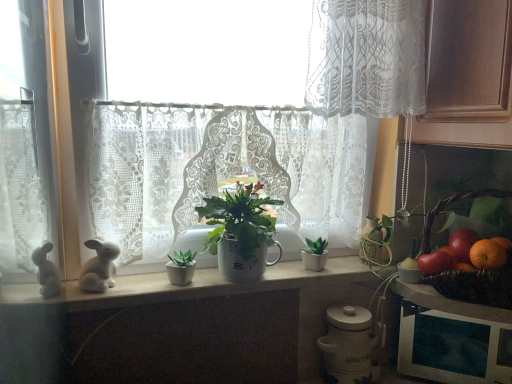
The width and height of the screenshot is (512, 384). What do you see at coordinates (476, 285) in the screenshot?
I see `brown woven basket at right` at bounding box center [476, 285].

What do you see at coordinates (240, 232) in the screenshot?
I see `white ceramic mug at center` at bounding box center [240, 232].

Image resolution: width=512 pixels, height=384 pixels. Describe the element at coordinates (435, 262) in the screenshot. I see `shiny red tomato at right, which ranks as the first fruit in left-to-right order` at that location.

Describe the element at coordinates (487, 254) in the screenshot. I see `orange matte at right` at that location.

In order to face wooden framed picture at lower right, should I rotate leftwards or rightwards?

Turn right by 25.336 degrees to look at wooden framed picture at lower right.

Measure the distance between shiny red tomato at right, acting as the 1th fruit starting from the right, and camera.

shiny red tomato at right, acting as the 1th fruit starting from the right, is 1.01 meters away from camera.

The height and width of the screenshot is (384, 512). I want to click on white lace curtain at upper center, the second curtain positioned from the left, so click(367, 58).

Identify the location of brown woven basket at right. (476, 285).

Is shiny red tomato at right, acting as the 1th fruit starting from the right, situated inside white lace curtain at center, arranged as the second curtain when viewed from the right, or outside?

shiny red tomato at right, acting as the 1th fruit starting from the right, is outside white lace curtain at center, arranged as the second curtain when viewed from the right.

Can you confirm if shiny red tomato at right, acting as the 1th fruit starting from the right, is taller than white lace curtain at center, the second curtain positioned from the top?

Incorrect, the height of shiny red tomato at right, acting as the 1th fruit starting from the right, is not larger of that of white lace curtain at center, the second curtain positioned from the top.

Could you measure the distance between shiny red tomato at right, acting as the 1th fruit starting from the right, and white lace curtain at center, arranged as the second curtain when viewed from the right?

shiny red tomato at right, acting as the 1th fruit starting from the right, and white lace curtain at center, arranged as the second curtain when viewed from the right, are 22.06 inches apart from each other.

Is shiny red tomato at right, acting as the 1th fruit starting from the right, far away from white lace curtain at center, which is the first curtain in bottom-to-top order?

No.

From the image's perspective, between orange matte at right and white ceramic mug at center, who is located below?

orange matte at right.

Is orange matte at right in front of or behind white ceramic mug at center in the image?

Visually, orange matte at right is located in front of white ceramic mug at center.

Does point (492, 239) lie in front of point (219, 222)?

Yes, it is.

Find the location of a particular element. This screenshot has width=512, height=384. orange in front of the white ceramic mug at center is located at coordinates (487, 254).

From the picture: From a real-world perspective, relative to matte white flowerpot at center, is brown woven basket at right vertically above or below?

In terms of real-world spatial position, brown woven basket at right is above matte white flowerpot at center.

Is brown woven basket at right touching matte white flowerpot at center?

No, brown woven basket at right is not next to matte white flowerpot at center.

How far apart are brown woven basket at right and matte white flowerpot at center?

brown woven basket at right is 66.53 centimeters from matte white flowerpot at center.

Can you tell me how much brown woven basket at right and matte white flowerpot at center differ in facing direction?

49.3 degrees.

From the picture: Can you confirm if white ceramic mug at center is smaller than white glossy rabbit at left?

No, white ceramic mug at center is not smaller than white glossy rabbit at left.

Is white ceramic mug at center not within white glossy rabbit at left?

That's correct, white ceramic mug at center is outside of white glossy rabbit at left.

Is white ceramic mug at center to the left of white glossy rabbit at left from the viewer's perspective?

In fact, white ceramic mug at center is to the right of white glossy rabbit at left.

From the image's perspective, does white ceramic mug at center appear lower than white glossy rabbit at left?

Incorrect, from the image's perspective, white ceramic mug at center is higher than white glossy rabbit at left.

Is orange matte at right at the left side of shiny red tomato at right, which appears as the 2th fruit when viewed from the right?

No.

Can you tell me how much orange matte at right and shiny red tomato at right, which appears as the 2th fruit when viewed from the right, differ in facing direction?

The facing directions of orange matte at right and shiny red tomato at right, which appears as the 2th fruit when viewed from the right, are 0.00263 degrees apart.

Does orange matte at right have a lesser height compared to shiny red tomato at right, which ranks as the first fruit in left-to-right order?

Indeed, orange matte at right has a lesser height compared to shiny red tomato at right, which ranks as the first fruit in left-to-right order.

The height and width of the screenshot is (384, 512). I want to click on fruit below the orange matte at right (from the image's perspective), so click(435, 262).

Does brown woven basket at right have a greater width compared to white matte counter top at center?

Yes.

Is brown woven basket at right turned away from white matte counter top at center?

brown woven basket at right does not have its back to white matte counter top at center.

Between brown woven basket at right and white matte counter top at center, which one is positioned in front?

brown woven basket at right.

From a real-world perspective, relative to white matte counter top at center, is brown woven basket at right vertically above or below?

brown woven basket at right is situated higher than white matte counter top at center in the real world.

Is brown woven basket at right positioned beyond the bounds of white lace curtain at center, arranged as the second curtain when viewed from the right?

brown woven basket at right is positioned outside white lace curtain at center, arranged as the second curtain when viewed from the right.

From the image's perspective, is brown woven basket at right above white lace curtain at center, the second curtain positioned from the top?

No, from the image's perspective, brown woven basket at right is not over white lace curtain at center, the second curtain positioned from the top.

Measure the distance from brown woven basket at right to white lace curtain at center, arranged as the second curtain when viewed from the right.

They are 49.09 centimeters apart.

Where is `the 2nd fruit behind the white lace curtain at center, which is the first curtain in bottom-to-top order, starting your count from the anchor`? Image resolution: width=512 pixels, height=384 pixels. the 2nd fruit behind the white lace curtain at center, which is the first curtain in bottom-to-top order, starting your count from the anchor is located at coordinates click(462, 244).

Locate an element on the screen. houseplant located on the left of orange matte at right is located at coordinates (240, 232).

Looking at the image, which one is located closer to wooden framed picture at lower right, white matte counter top at center or white lace curtain at upper center, the second curtain positioned from the bottom?

white matte counter top at center lies closer to wooden framed picture at lower right than the other object.

When comparing their distances from wooden framed picture at lower right, does shiny red tomato at right, acting as the 1th fruit starting from the right, or white glossy rabbit at left seem further?

Among the two, white glossy rabbit at left is located further to wooden framed picture at lower right.

Which object lies nearer to the anchor point white lace curtain at center, the second curtain positioned from the top, white ceramic mug at center or wooden framed picture at lower right?

white ceramic mug at center is closer to white lace curtain at center, the second curtain positioned from the top.

Looking at this image, from the image, which object appears to be nearer to white lace curtain at upper center, placed as the first curtain when sorted from top to bottom, white ceramic mug at center or white matte counter top at center?

The object closer to white lace curtain at upper center, placed as the first curtain when sorted from top to bottom, is white ceramic mug at center.

Which object lies nearer to the anchor point white glossy rabbit at left, white ceramic mug at center or wooden framed picture at lower right?

white ceramic mug at center is closer to white glossy rabbit at left.

Estimate the real-world distances between objects in this image. Which object is further from matte white flowerpot at center, brown woven basket at right or shiny red tomato at right, which appears as the 2th fruit when viewed from the right?

brown woven basket at right is positioned further to the anchor matte white flowerpot at center.

Which object lies nearer to the anchor point wooden framed picture at lower right, white ceramic mug at center or shiny red tomato at right, acting as the 1th fruit starting from the right?

shiny red tomato at right, acting as the 1th fruit starting from the right, is closer to wooden framed picture at lower right.

When comparing their distances from brown woven basket at right, does matte white flowerpot at center or shiny red tomato at right, which ranks as the first fruit in left-to-right order, seem closer?

shiny red tomato at right, which ranks as the first fruit in left-to-right order, is closer to brown woven basket at right.

The image size is (512, 384). Identify the location of curtain between white lace curtain at upper center, the second curtain positioned from the bottom, and white matte counter top at center, in the vertical direction. (219, 170).

The height and width of the screenshot is (384, 512). Identify the location of counter top between white glossy rabbit at left and brown woven basket at right. (195, 286).

Where is `counter top between matte white flowerpot at center and white ceramic mug at center from left to right`? This screenshot has width=512, height=384. counter top between matte white flowerpot at center and white ceramic mug at center from left to right is located at coordinates (195, 286).

Identify the location of counter top between white lace curtain at upper center, the first curtain from the right, and wooden framed picture at lower right from top to bottom. The height and width of the screenshot is (384, 512). (195, 286).